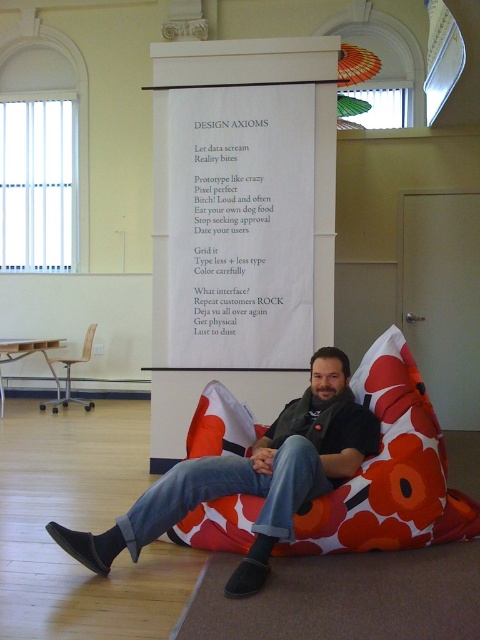
Question: Based on their relative distances, which object is farther from the denim jeans at center?

Choices:
 (A) wooden chair at left
 (B) floral fabric bean bag at center

Answer: (A)

Question: Where is denim jeans at center located in relation to wooden chair at left in the image?

Choices:
 (A) above
 (B) below

Answer: (B)

Question: Which point appears farthest from the camera in this image?

Choices:
 (A) (86, 330)
 (B) (339, 467)
 (C) (408, 410)

Answer: (A)

Question: Does denim jeans at center have a smaller size compared to wooden chair at left?

Choices:
 (A) yes
 (B) no

Answer: (B)

Question: Does floral fabric bean bag at center have a larger size compared to wooden chair at left?

Choices:
 (A) no
 (B) yes

Answer: (B)

Question: Which object is positioned closest to the floral fabric bean bag at center?

Choices:
 (A) denim jeans at center
 (B) wooden chair at left

Answer: (A)